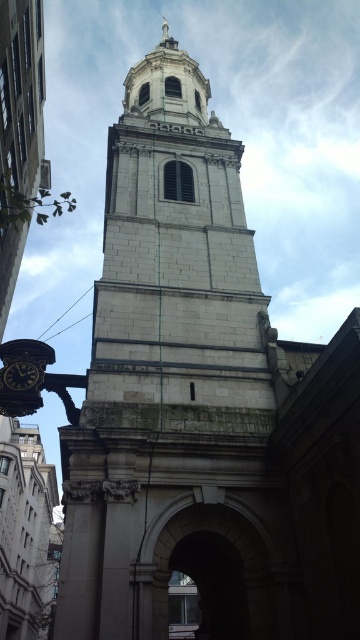
Between stone archway at center and black glossy clock at lower left, which one is positioned higher?

black glossy clock at lower left is above.

Does stone archway at center appear under black glossy clock at lower left?

Correct, stone archway at center is located below black glossy clock at lower left.

Between point (222, 509) and point (2, 369), which one is positioned behind?

The point (2, 369) is behind.

Identify the location of stone archway at center. (209, 573).